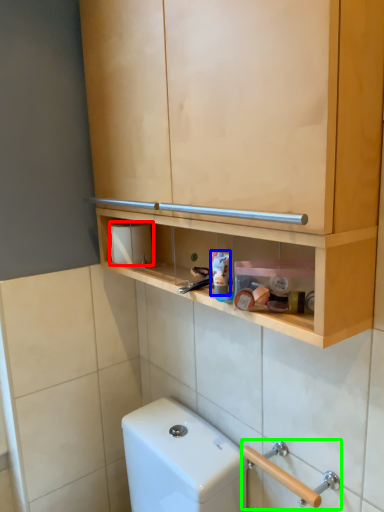
Question: Estimate the real-world distances between objects in this image. Which object is farther from toilet paper (highlighted by a red box), toothpaste (highlighted by a blue box) or door handle (highlighted by a green box)?

Choices:
 (A) toothpaste
 (B) door handle

Answer: (B)